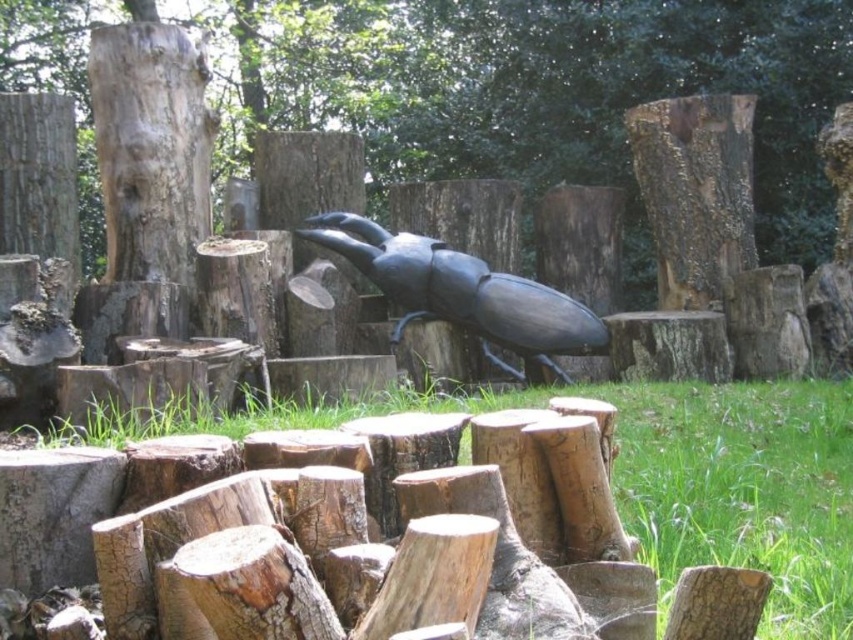
Is smooth brown tree trunk at upper left behind black matte beetle at center?

No, smooth brown tree trunk at upper left is in front of black matte beetle at center.

Can you confirm if smooth brown tree trunk at upper left is smaller than black matte beetle at center?

Correct, smooth brown tree trunk at upper left occupies less space than black matte beetle at center.

Image resolution: width=853 pixels, height=640 pixels. What do you see at coordinates (151, 148) in the screenshot? I see `smooth brown tree trunk at upper left` at bounding box center [151, 148].

The height and width of the screenshot is (640, 853). Find the location of `smooth brown tree trunk at upper left`. smooth brown tree trunk at upper left is located at coordinates (151, 148).

Measure the distance between green grass at center and black matte beetle at center.

They are 1.45 meters apart.

Does green grass at center appear on the left side of black matte beetle at center?

In fact, green grass at center is to the right of black matte beetle at center.

What do you see at coordinates (746, 490) in the screenshot?
I see `green grass at center` at bounding box center [746, 490].

Locate an element on the screen. The height and width of the screenshot is (640, 853). green grass at center is located at coordinates (746, 490).

Measure the distance between smooth wood stump at center and black matte beetle at center.

smooth wood stump at center and black matte beetle at center are 3.64 meters apart.

Between smooth wood stump at center and black matte beetle at center, which one appears on the left side from the viewer's perspective?

black matte beetle at center is more to the left.

At what (x,y) coordinates should I click in order to perform the action: click on smooth wood stump at center. Please return your answer as a coordinate pair (x, y). Looking at the image, I should click on (561, 88).